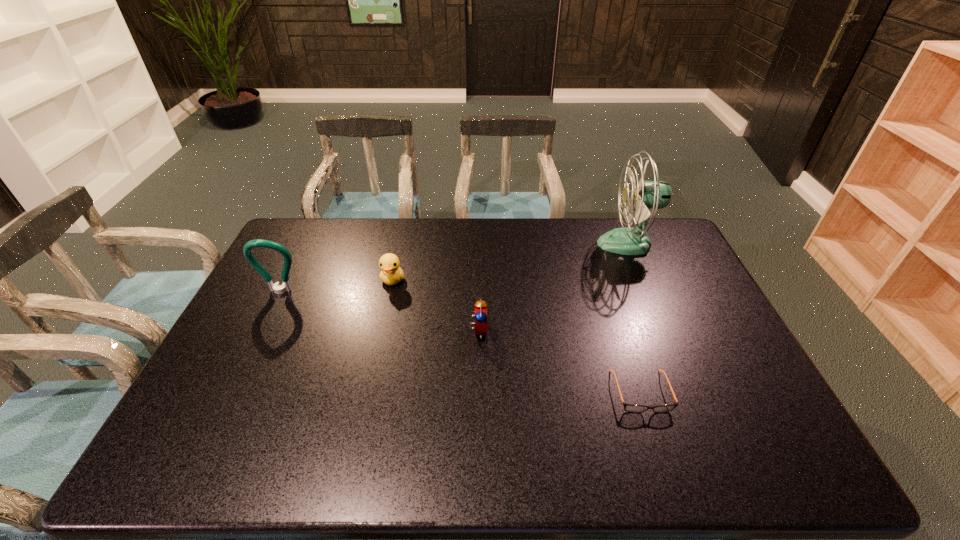
Locate an element on the screen. vacant space that satisfies the following two spatial constraints: 1. in front of the farthest object, directing airflow; 2. on the face of the duck is located at coordinates (643, 280).